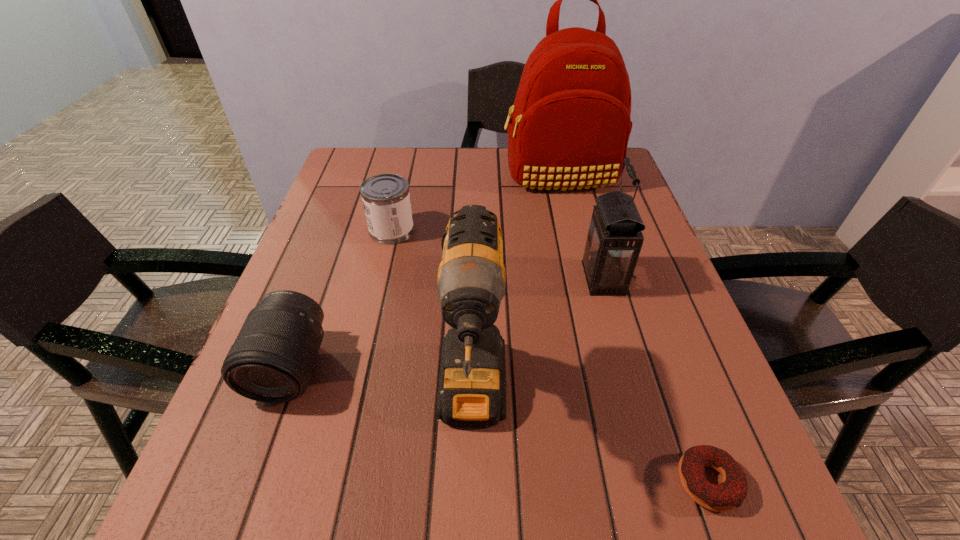
The image size is (960, 540). I want to click on the tallest object, so click(x=570, y=126).

Identify the location of backpack. The image size is (960, 540). click(570, 126).

The width and height of the screenshot is (960, 540). Find the location of `drill`. drill is located at coordinates (471, 280).

Where is `the second tallest object`? This screenshot has width=960, height=540. the second tallest object is located at coordinates (471, 280).

You are a GUI agent. You are given a task and a screenshot of the screen. Output one action in this format:
    pyautogui.click(x=<x>, y=<y>)
    Task: Click on the third tallest object
    
    Given the screenshot: What is the action you would take?
    pyautogui.click(x=614, y=240)

Identify the location of the fourth nearest object. The image size is (960, 540). pyautogui.click(x=614, y=240).

You are a GUI agent. You are given a task and a screenshot of the screen. Output one action in this format:
    pyautogui.click(x=<x>, y=<y>)
    Task: Click on the telephoto lens
    
    Given the screenshot: What is the action you would take?
    pyautogui.click(x=272, y=360)

You are a GUI agent. You are given a task and a screenshot of the screen. Output one action in this format:
    pyautogui.click(x=<x>, y=<y>)
    Task: Click on the fifth object from right to left
    The height and width of the screenshot is (540, 960).
    Given the screenshot: What is the action you would take?
    pyautogui.click(x=386, y=199)

Locate an element on the screen. The image size is (960, 540). can is located at coordinates (386, 199).

The width and height of the screenshot is (960, 540). I want to click on the shortest object, so (731, 492).